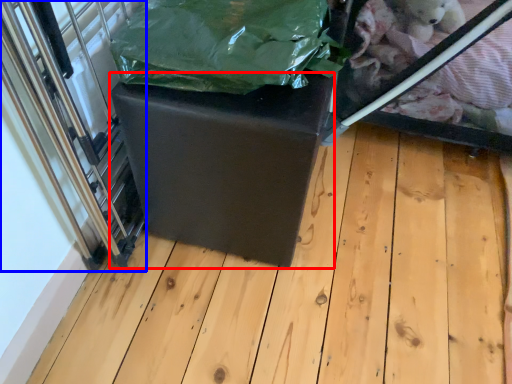
Question: Which of the following is the closest to the observer, table (highlighted by a red box) or glass door (highlighted by a blue box)?

Choices:
 (A) table
 (B) glass door

Answer: (B)